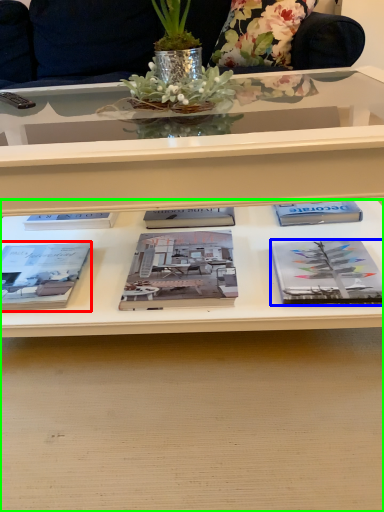
Question: Estimate the real-world distances between objects in this image. Which object is closer to book (highlighted by a red box), book (highlighted by a blue box) or desk (highlighted by a green box)?

Choices:
 (A) book
 (B) desk

Answer: (B)